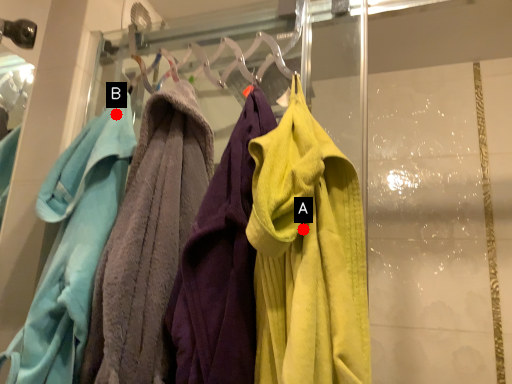
Question: Two points are circled on the image, labeled by A and B beside each circle. Which point is farther to the camera?

Choices:
 (A) A is further
 (B) B is further

Answer: (B)